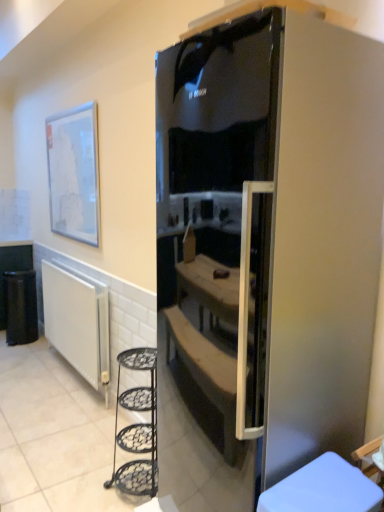
Question: From the image's perspective, is satin black fridge at center beneath white ribbed radiator at lower left?

Choices:
 (A) no
 (B) yes

Answer: (A)

Question: Is satin black fridge at center shorter than white ribbed radiator at lower left?

Choices:
 (A) no
 (B) yes

Answer: (A)

Question: Is white ribbed radiator at lower left located within satin black fridge at center?

Choices:
 (A) yes
 (B) no

Answer: (B)

Question: Considering the relative sizes of satin black fridge at center and white ribbed radiator at lower left in the image provided, is satin black fridge at center bigger than white ribbed radiator at lower left?

Choices:
 (A) no
 (B) yes

Answer: (B)

Question: Is satin black fridge at center facing towards white ribbed radiator at lower left?

Choices:
 (A) no
 (B) yes

Answer: (A)

Question: Is satin black fridge at center looking in the opposite direction of white ribbed radiator at lower left?

Choices:
 (A) no
 (B) yes

Answer: (A)

Question: From a real-world perspective, is black plastic trash bin at lower left under satin black fridge at center?

Choices:
 (A) yes
 (B) no

Answer: (A)

Question: Can you confirm if black plastic trash bin at lower left is shorter than satin black fridge at center?

Choices:
 (A) no
 (B) yes

Answer: (B)

Question: From the image's perspective, does black plastic trash bin at lower left appear lower than satin black fridge at center?

Choices:
 (A) no
 (B) yes

Answer: (B)

Question: Is black plastic trash bin at lower left to the right of satin black fridge at center from the viewer's perspective?

Choices:
 (A) yes
 (B) no

Answer: (B)

Question: Considering the relative sizes of black plastic trash bin at lower left and satin black fridge at center in the image provided, is black plastic trash bin at lower left bigger than satin black fridge at center?

Choices:
 (A) no
 (B) yes

Answer: (A)

Question: From the image's perspective, is black plastic trash bin at lower left on satin black fridge at center?

Choices:
 (A) yes
 (B) no

Answer: (B)

Question: From the image's perspective, would you say white ribbed radiator at lower left is shown under satin black fridge at center?

Choices:
 (A) no
 (B) yes

Answer: (B)